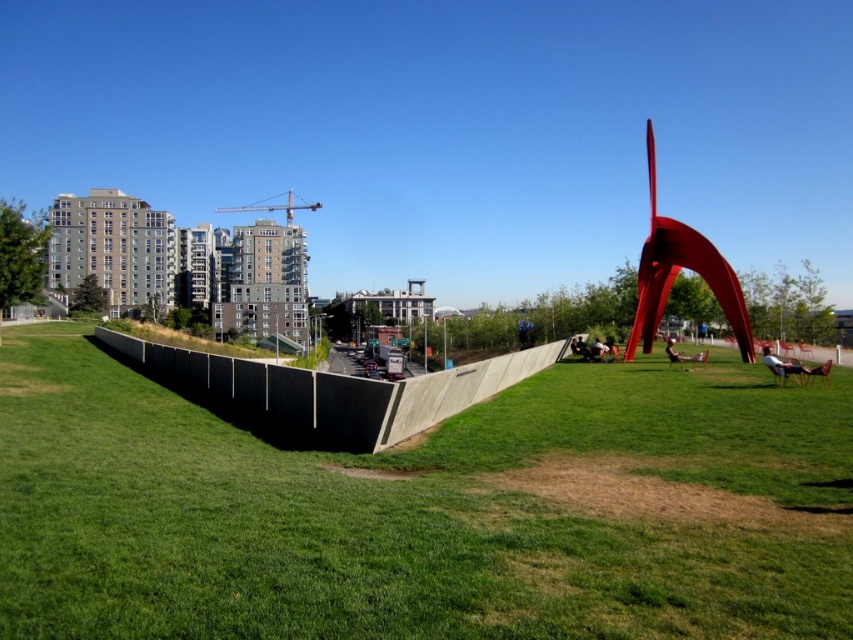
You are standing at the point with coordinates (424, 509) in the urban park scene. What type of terrain are you currently standing on?

The point at coordinates (424, 509) corresponds to the green grassy area at center, so you are standing on grass.

You are planning to set up a picnic blanket in the urban park scene. The picnic blanket is 2 meters wide. You want to place it on the green grassy area at center. Considering the width of the green grassy at center and the polished red metal abstract art at right, will the blanket fit without overlapping the sculpture?

The green grassy at center has a lesser width compared to polished red metal abstract art at right. Since the grassy area is narrower, the 2m wide picnic blanket may not fit entirely without overlapping the sculpture unless the sculpture is positioned far enough. However, the description does not specify the exact distance between them. Therefore, it is uncertain if the blanket will fit without overlapping.